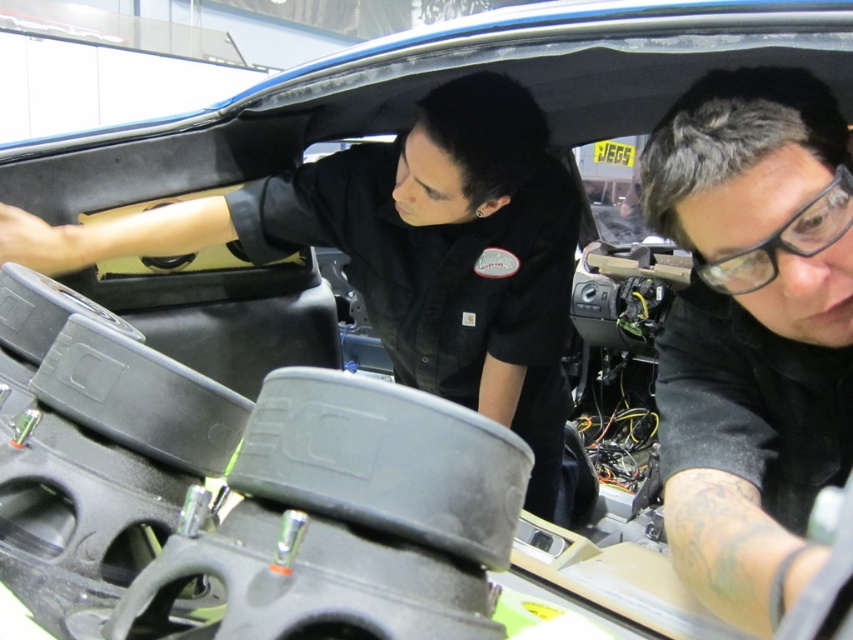
Question: Is black matte shirt at center further to the viewer compared to black matte shirt at upper center?

Choices:
 (A) yes
 (B) no

Answer: (B)

Question: Among these objects, which one is farthest from the camera?

Choices:
 (A) black matte shirt at upper center
 (B) black matte shirt at center

Answer: (A)

Question: Does black matte shirt at center have a smaller size compared to black matte shirt at upper center?

Choices:
 (A) yes
 (B) no

Answer: (A)

Question: Is black matte shirt at center to the left of black matte shirt at upper center from the viewer's perspective?

Choices:
 (A) yes
 (B) no

Answer: (B)